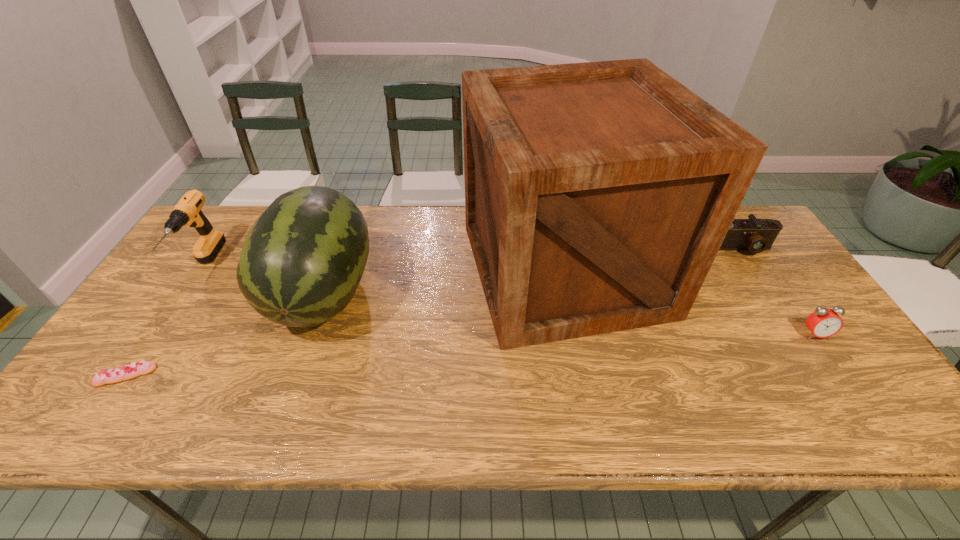
The width and height of the screenshot is (960, 540). In order to click on free spot located on the right of the fourth object from right to left in this screenshot , I will do `click(468, 294)`.

You are a GUI agent. You are given a task and a screenshot of the screen. Output one action in this format:
    pyautogui.click(x=<x>, y=<y>)
    Task: Click on the vacant space situated at the tip of the third tallest object
    The image size is (960, 540).
    Given the screenshot: What is the action you would take?
    pyautogui.click(x=167, y=322)

The image size is (960, 540). Identify the location of free location located 0.330m on the lens of the camera. (804, 346).

The height and width of the screenshot is (540, 960). Find the location of `free point located on the front-facing side of the alarm clock`. free point located on the front-facing side of the alarm clock is located at coordinates (873, 418).

What are the coordinates of `vacant point located 0.280m on the back of the shortest object` in the screenshot? It's located at (189, 282).

In order to click on box situated at the far edge in this screenshot , I will do `click(597, 195)`.

This screenshot has width=960, height=540. I want to click on watermelon located at the far edge, so click(302, 261).

At what (x,y) coordinates should I click in order to perform the action: click on drill at the far edge. Please return your answer as a coordinate pair (x, y). Image resolution: width=960 pixels, height=540 pixels. Looking at the image, I should click on (188, 212).

I want to click on camera situated at the far edge, so click(756, 235).

Locate an element on the screen. Image resolution: width=960 pixels, height=540 pixels. drill that is positioned at the left edge is located at coordinates 188,212.